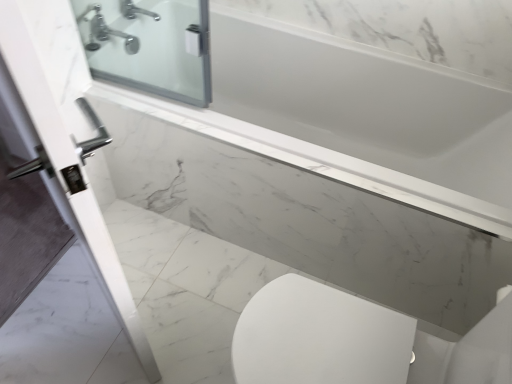
You are a GUI agent. You are given a task and a screenshot of the screen. Output one action in this format:
    pyautogui.click(x=<x>, y=<y>)
    Task: Click on the vacant space situated above white marble ledge at upper center (from a real-world perspective)
    The width and height of the screenshot is (512, 384).
    Given the screenshot: What is the action you would take?
    pyautogui.click(x=295, y=163)